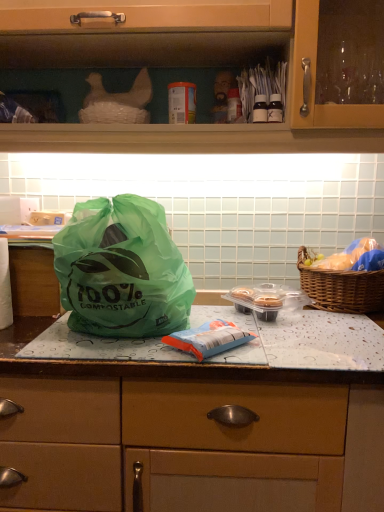
Find the location of a particular element. The width and height of the screenshot is (384, 512). free space in front of brown woven picnic basket at right is located at coordinates (335, 329).